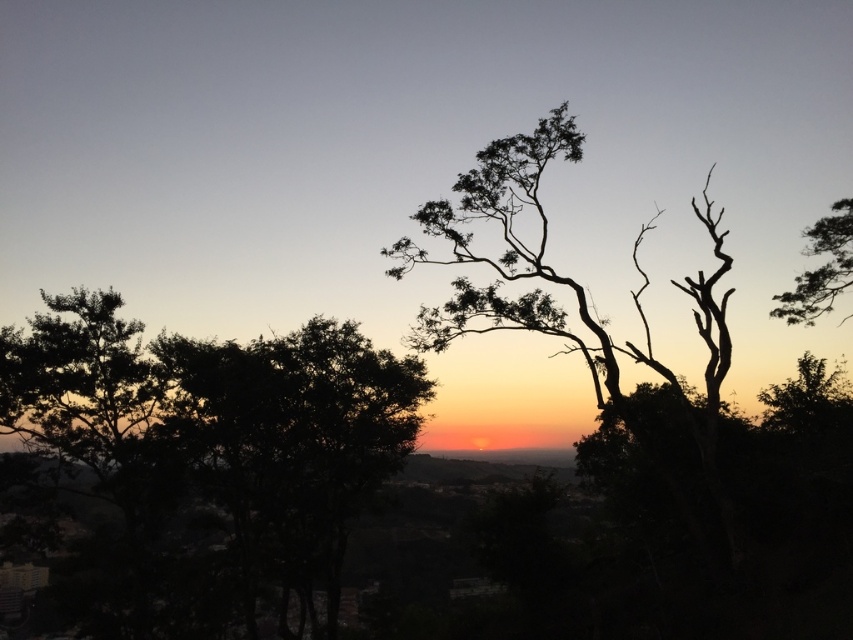
Question: Can you confirm if dark green leafy tree at center is smaller than silhouette bark tree at upper right?

Choices:
 (A) yes
 (B) no

Answer: (A)

Question: Does dark green leafy tree at center appear on the left side of silhouette bark tree at upper right?

Choices:
 (A) no
 (B) yes

Answer: (B)

Question: Which point is farther to the camera?

Choices:
 (A) (253, 563)
 (B) (817, 244)

Answer: (A)

Question: Is dark green leafy tree at center to the left of silhouette bark tree at upper right from the viewer's perspective?

Choices:
 (A) yes
 (B) no

Answer: (A)